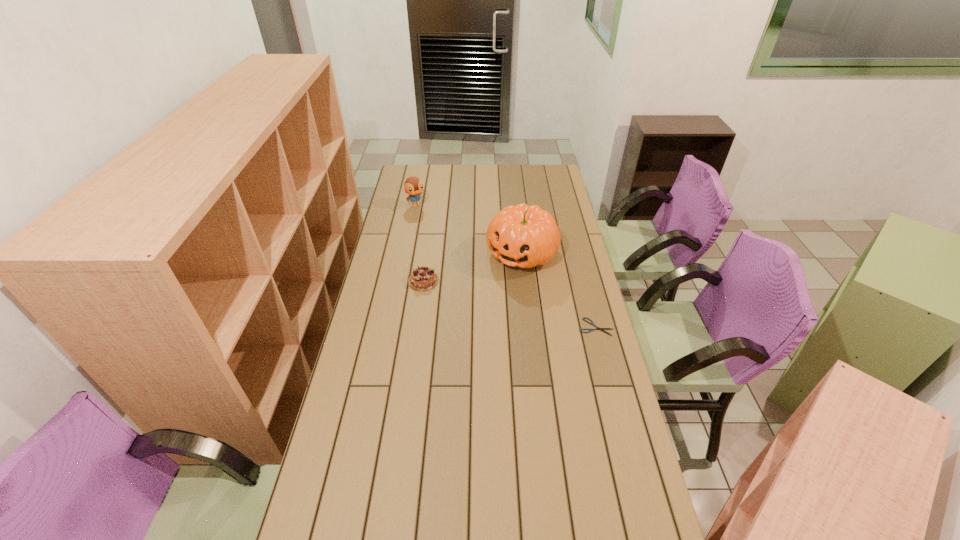
At what (x,y) coordinates should I click in order to perform the action: click on vacant area located 0.360m on the carved face of the tallest object. Please return your answer as a coordinate pair (x, y). Image resolution: width=960 pixels, height=540 pixels. Looking at the image, I should click on (456, 328).

At what (x,y) coordinates should I click in order to perform the action: click on free space located on the carved face of the tallest object. Please return your answer as a coordinate pair (x, y). Image resolution: width=960 pixels, height=540 pixels. Looking at the image, I should click on (450, 335).

Identify the location of vacant space located on the front-facing side of the duck. (446, 246).

At what (x,y) coordinates should I click in order to perform the action: click on free location located 0.390m on the front-facing side of the duck. Please return your answer as a coordinate pair (x, y). This screenshot has height=540, width=960. Looking at the image, I should click on (453, 254).

The height and width of the screenshot is (540, 960). I want to click on vacant space situated on the front-facing side of the duck, so click(422, 216).

The image size is (960, 540). What are the coordinates of `chocolate cake that is at the left edge` in the screenshot? It's located at (422, 279).

Identify the location of duck at the left edge. (413, 186).

Locate an element on the screen. The height and width of the screenshot is (540, 960). shears present at the right edge is located at coordinates (597, 328).

The width and height of the screenshot is (960, 540). Find the location of `pumpkin that is at the right edge`. pumpkin that is at the right edge is located at coordinates (525, 236).

Identify the location of vacant region at the far edge. (433, 170).